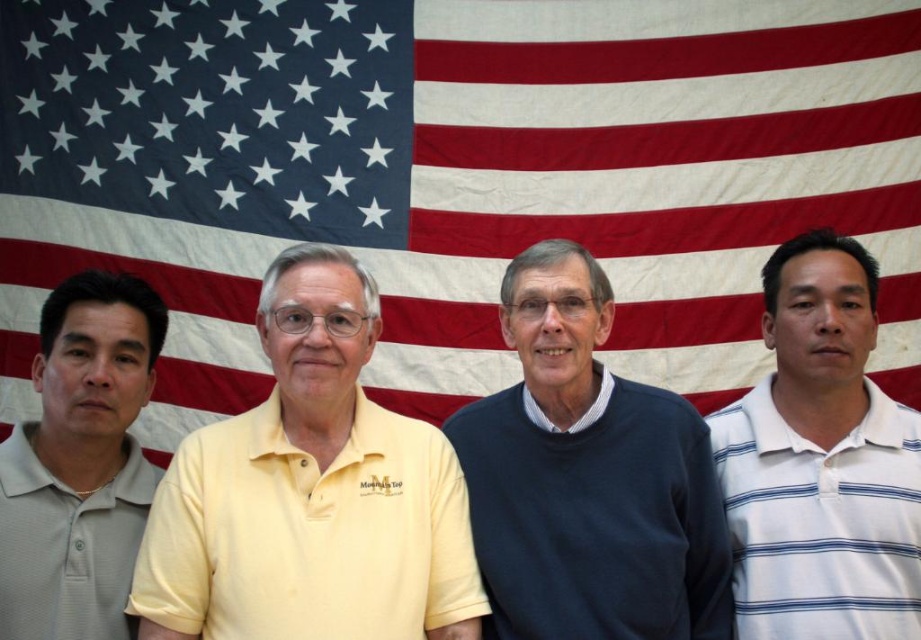
Does white fabric flag at upper center appear on the right side of dark blue sweater at center?

No, white fabric flag at upper center is not to the right of dark blue sweater at center.

Is white fabric flag at upper center positioned before dark blue sweater at center?

No, white fabric flag at upper center is behind dark blue sweater at center.

Image resolution: width=921 pixels, height=640 pixels. In order to click on white fabric flag at upper center in this screenshot , I will do `click(453, 173)`.

Can you confirm if white fabric flag at upper center is positioned to the right of white striped polo shirt at right?

In fact, white fabric flag at upper center is to the left of white striped polo shirt at right.

The image size is (921, 640). In order to click on white fabric flag at upper center in this screenshot , I will do `click(453, 173)`.

Who is more forward, (329, 12) or (913, 538)?

Point (913, 538) is in front.

Locate an element on the screen. white fabric flag at upper center is located at coordinates (453, 173).

Is white striped polo shirt at right closer to the viewer compared to gray matte polo shirt at left?

No, it is behind gray matte polo shirt at left.

Who is more distant from viewer, (864, 458) or (73, 436)?

Result: The point (864, 458) is more distant.

This screenshot has height=640, width=921. What are the coordinates of `white striped polo shirt at right` in the screenshot? It's located at (822, 461).